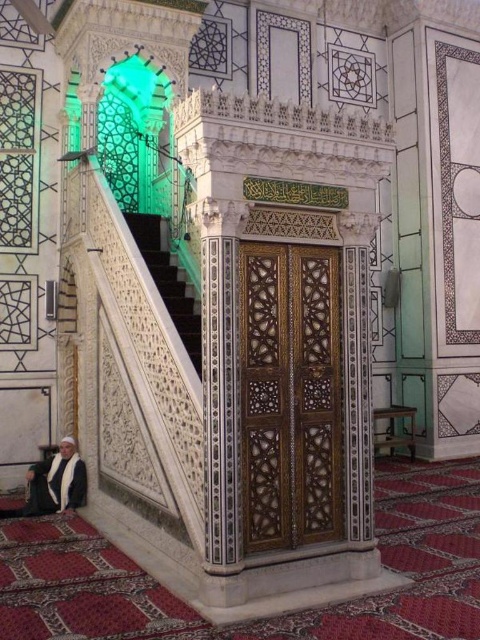
Question: Which object is farther from the camera taking this photo?

Choices:
 (A) white carved wood stairs at center
 (B) white fabric person at lower left

Answer: (B)

Question: From the image, what is the correct spatial relationship of white carved wood stairs at center in relation to white fabric person at lower left?

Choices:
 (A) left
 (B) right

Answer: (B)

Question: Can you confirm if white carved wood stairs at center is bigger than white fabric person at lower left?

Choices:
 (A) no
 (B) yes

Answer: (B)

Question: Which point is farther to the camera?

Choices:
 (A) (192, 300)
 (B) (45, 502)

Answer: (A)

Question: Does white carved wood stairs at center appear under white fabric person at lower left?

Choices:
 (A) yes
 (B) no

Answer: (B)

Question: Which of the following is the farthest from the observer?

Choices:
 (A) (81, 493)
 (B) (171, 291)

Answer: (B)